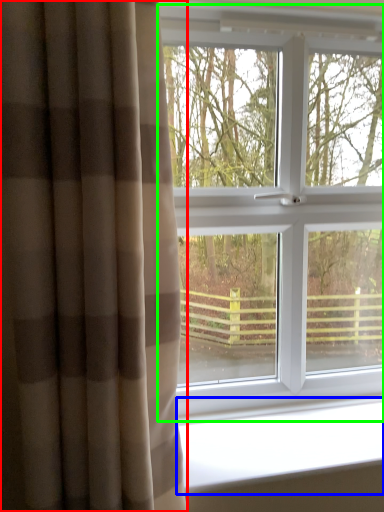
Question: Which object is the farthest from curtain (highlighted by a red box)? Choose among these: window sill (highlighted by a blue box) or window (highlighted by a green box).

Choices:
 (A) window sill
 (B) window

Answer: (B)